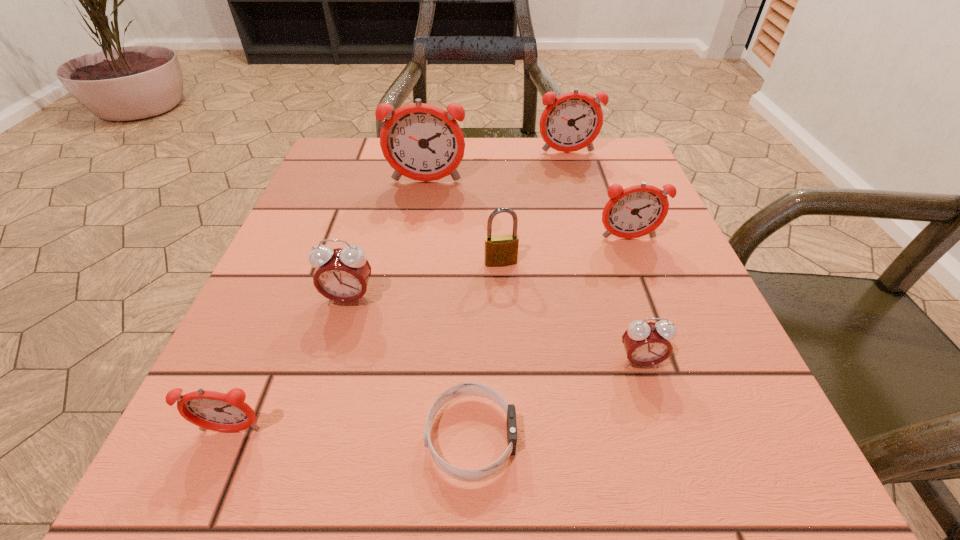
You are a GUI agent. You are given a task and a screenshot of the screen. Output one action in this format:
    pyautogui.click(x=<x>, y=<y>)
    Task: Click on the vacant space situated on the clock face of the fifth farthest alarm clock
    The height and width of the screenshot is (540, 960).
    Given the screenshot: What is the action you would take?
    pyautogui.click(x=675, y=473)

Locate an element on the screen. The height and width of the screenshot is (540, 960). free space located on the front-facing side of the leftmost alarm clock is located at coordinates [202, 499].

Locate an element on the screen. The height and width of the screenshot is (540, 960). free space located on the outer surface of the wristband is located at coordinates click(620, 437).

Identify the location of alarm clock that is at the near edge. (212, 410).

In order to click on wristband located in the near edge section of the desktop in this screenshot , I will do `click(467, 388)`.

At what (x,y) coordinates should I click in order to perform the action: click on object present at the far left corner. Please return your answer as a coordinate pair (x, y). Looking at the image, I should click on pyautogui.click(x=423, y=142).

What are the coordinates of `object that is positioned at the near left corner` in the screenshot? It's located at (212, 410).

Locate an element on the screen. This screenshot has height=540, width=960. object located in the far right corner section of the desktop is located at coordinates (572, 121).

Where is `vacant space at the far edge of the desktop`? Image resolution: width=960 pixels, height=540 pixels. vacant space at the far edge of the desktop is located at coordinates (487, 145).

Where is `free spot at the near edge of the desktop`? The height and width of the screenshot is (540, 960). free spot at the near edge of the desktop is located at coordinates (646, 470).